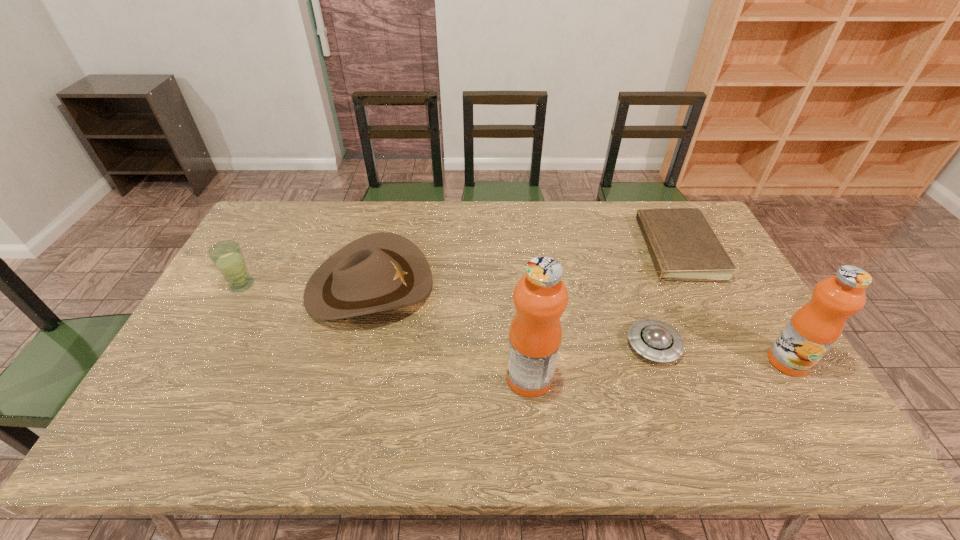
Find the location of a particular element. This screenshot has height=540, width=960. free spot between the fifth object from right to left and the right fruit juice is located at coordinates (579, 324).

The height and width of the screenshot is (540, 960). What are the coordinates of `free spot between the shorter fruit juice and the fifth object from right to left` in the screenshot? It's located at (579, 324).

Where is `empty space between the second shortest object and the glass`? This screenshot has width=960, height=540. empty space between the second shortest object and the glass is located at coordinates (447, 315).

You are a GUI agent. You are given a task and a screenshot of the screen. Output one action in this format:
    pyautogui.click(x=<x>, y=<y>)
    Task: Click on the empty space between the taller fruit juice and the fifth tallest object
    
    Given the screenshot: What is the action you would take?
    pyautogui.click(x=591, y=361)

The image size is (960, 540). Find the location of `vacant area between the second shortest object and the taller fruit juice`. vacant area between the second shortest object and the taller fruit juice is located at coordinates (591, 361).

Where is `vacant region between the shorter fruit juice and the fifth tallest object`? vacant region between the shorter fruit juice and the fifth tallest object is located at coordinates (721, 353).

Identify which object is located as the second nearest to the second object from left to right. Please provide its 2D coordinates. Your answer should be formatted as a tuple, i.e. [(x, y)], where the tuple contains the x and y coordinates of a point satisfying the conditions above.

[(540, 297)]

At what (x,y) coordinates should I click in order to perform the action: click on object that is the second closest to the cowboy hat. Please return your answer as a coordinate pair (x, y). The image size is (960, 540). Looking at the image, I should click on (540, 297).

Where is `free space that satisfies the following two spatial constraints: 1. on the back side of the second shortest object; 2. with a star on the front of the cowboy hat`? Image resolution: width=960 pixels, height=540 pixels. free space that satisfies the following two spatial constraints: 1. on the back side of the second shortest object; 2. with a star on the front of the cowboy hat is located at coordinates (633, 286).

At what (x,y) coordinates should I click in order to perform the action: click on free spot that satisfies the following two spatial constraints: 1. with a star on the front of the cowboy hat; 2. on the back side of the fourth object from right to left. Please return your answer as a coordinate pair (x, y). The width and height of the screenshot is (960, 540). Looking at the image, I should click on (347, 377).